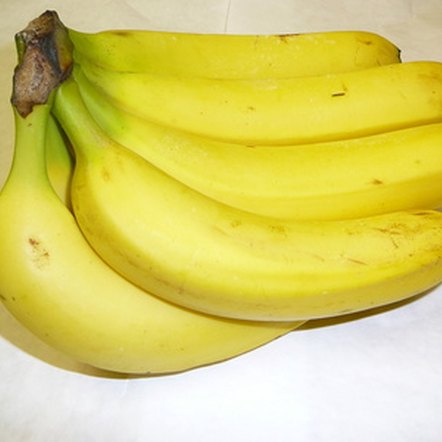
Identify the location of 1 solid surface. (260, 400).